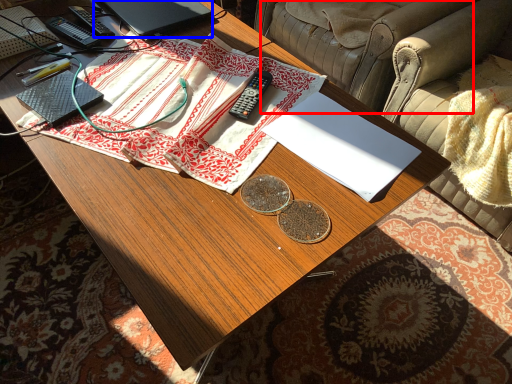
Question: Which object is closer to the camera taking this photo, armchair (highlighted by a red box) or laptop (highlighted by a blue box)?

Choices:
 (A) armchair
 (B) laptop

Answer: (B)